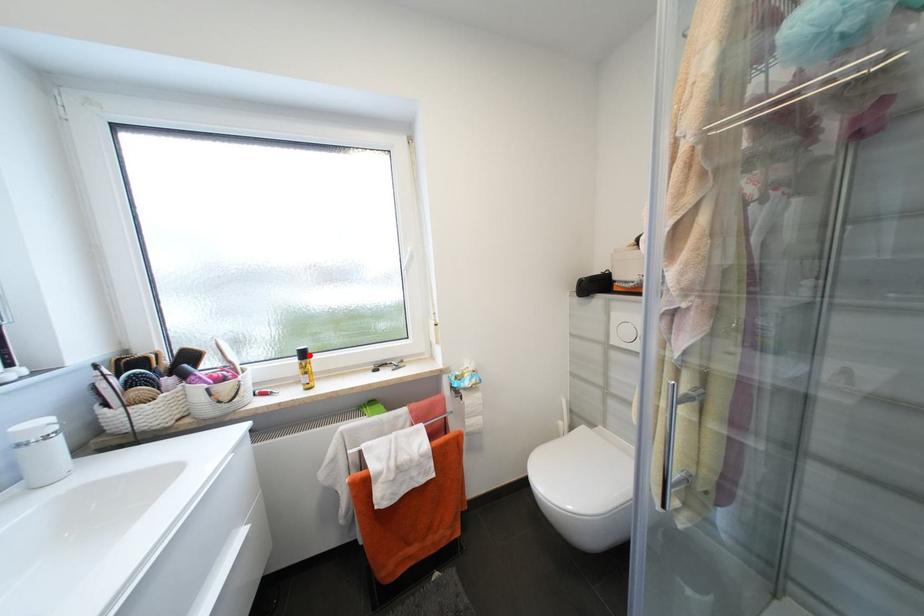
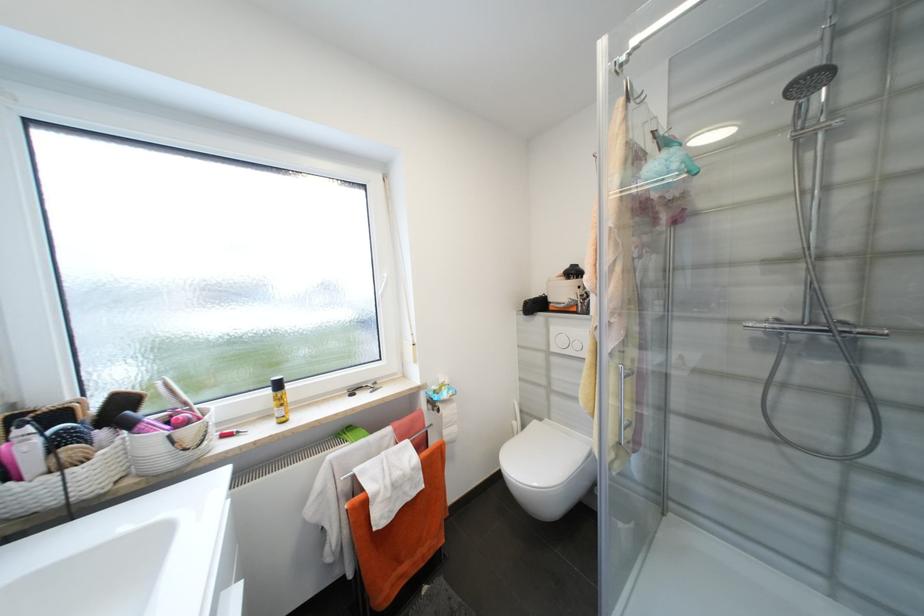
Where in the second image is the point corresponding to the highlighted location from the first image?

(284, 386)